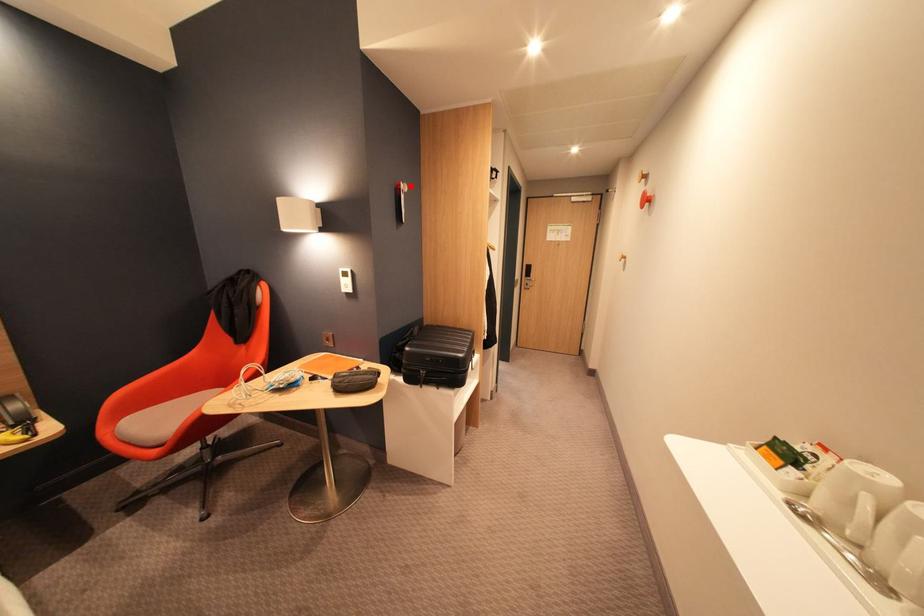
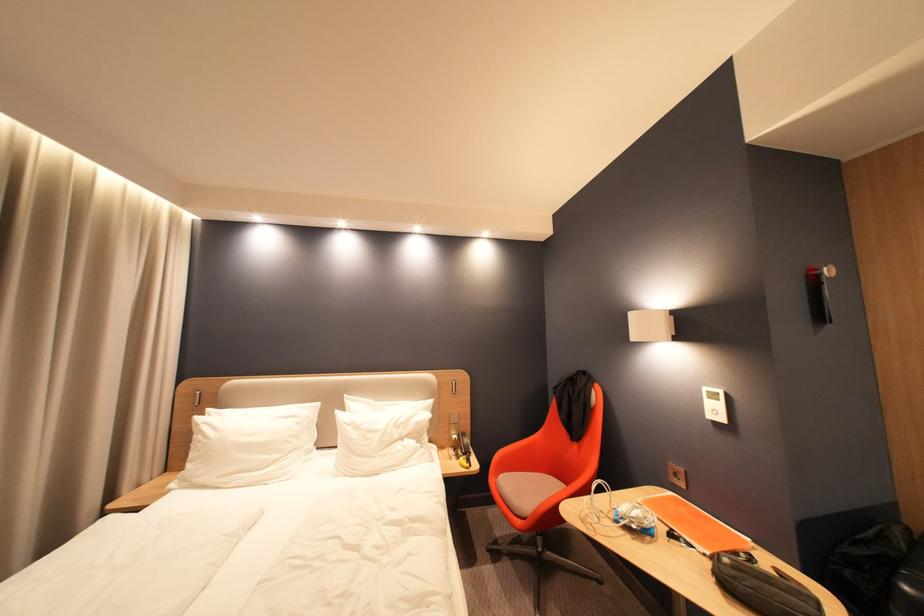
Where in the second image is the point corresponding to the highlighted location from the first image?

(830, 270)